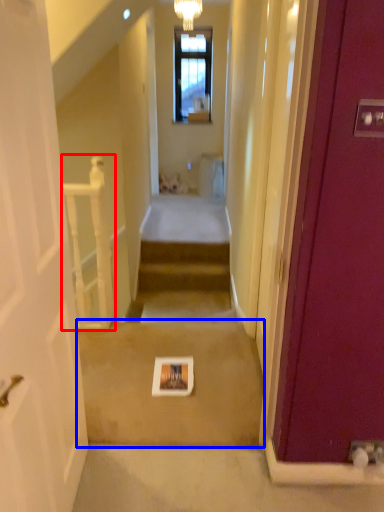
Question: Which point is further to the camera, balustrade (highlighted by a red box) or path (highlighted by a blue box)?

Choices:
 (A) balustrade
 (B) path

Answer: (A)